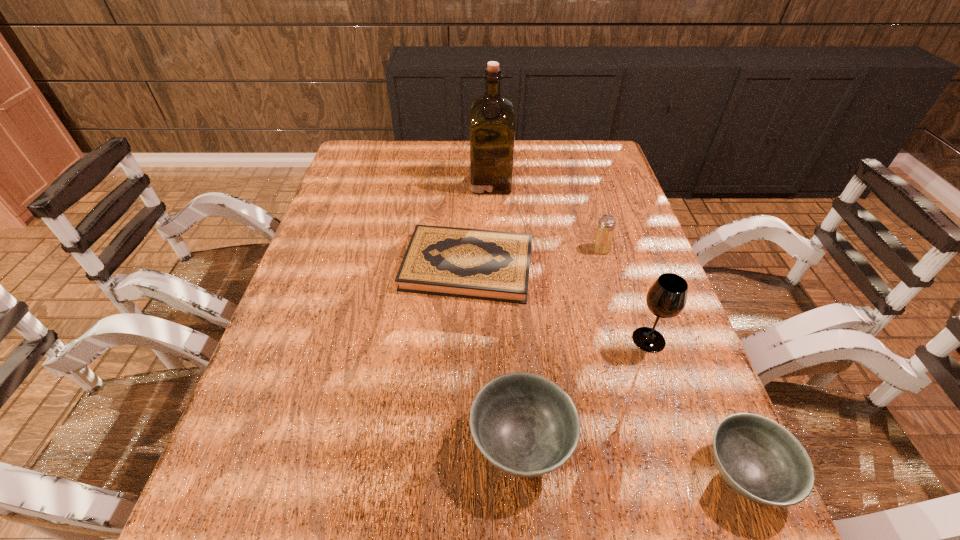
Locate an element on the screen. This screenshot has width=960, height=540. blank region between the saltshaker and the tallest object is located at coordinates (545, 215).

Locate an element on the screen. This screenshot has width=960, height=540. vacant area between the fourth farthest object and the left bowl is located at coordinates (585, 391).

Where is `free point between the left bowl and the saltshaker`? The image size is (960, 540). free point between the left bowl and the saltshaker is located at coordinates (561, 346).

The height and width of the screenshot is (540, 960). Identify the location of unoccupied area between the tallest object and the third nearest object. (569, 261).

You are a GUI agent. You are given a task and a screenshot of the screen. Output one action in this format:
    pyautogui.click(x=<x>, y=<y>)
    Task: Click on the free spot between the saltshaker and the shorter bowl
    The height and width of the screenshot is (540, 960).
    Given the screenshot: What is the action you would take?
    pyautogui.click(x=673, y=361)

Locate an element on the screen. vacant space that's between the shortest object and the left bowl is located at coordinates pyautogui.click(x=494, y=354).

Identify the location of free spot between the saltshaker and the liquor. Image resolution: width=960 pixels, height=540 pixels. 545,215.

Where is `free spot between the third shortest object and the right bowl`? free spot between the third shortest object and the right bowl is located at coordinates (634, 457).

This screenshot has height=540, width=960. What are the coordinates of `vacant space in between the fifth shortest object and the liquor` in the screenshot? It's located at (569, 261).

The height and width of the screenshot is (540, 960). Find the location of `object that stands as the third closest to the shorter bowl`. object that stands as the third closest to the shorter bowl is located at coordinates (478, 264).